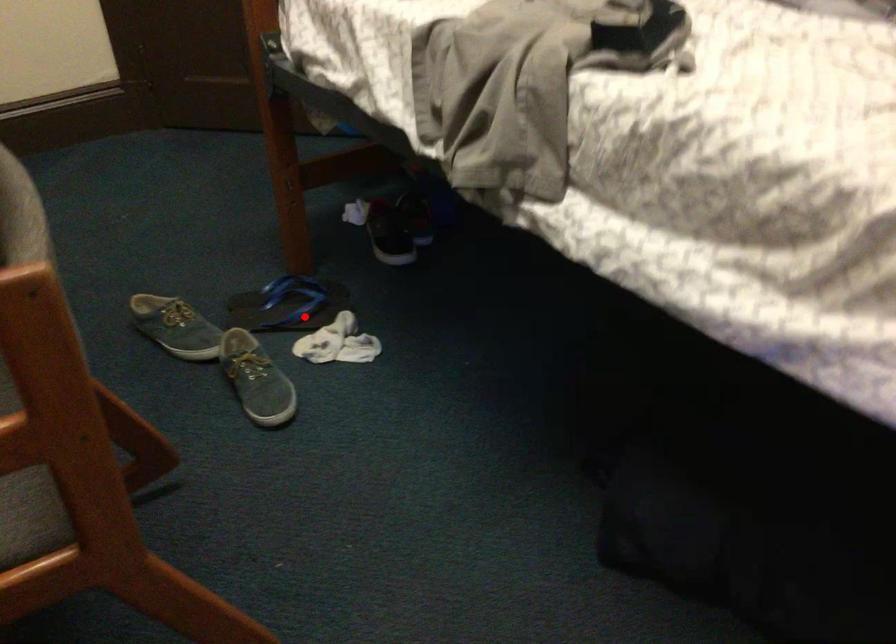
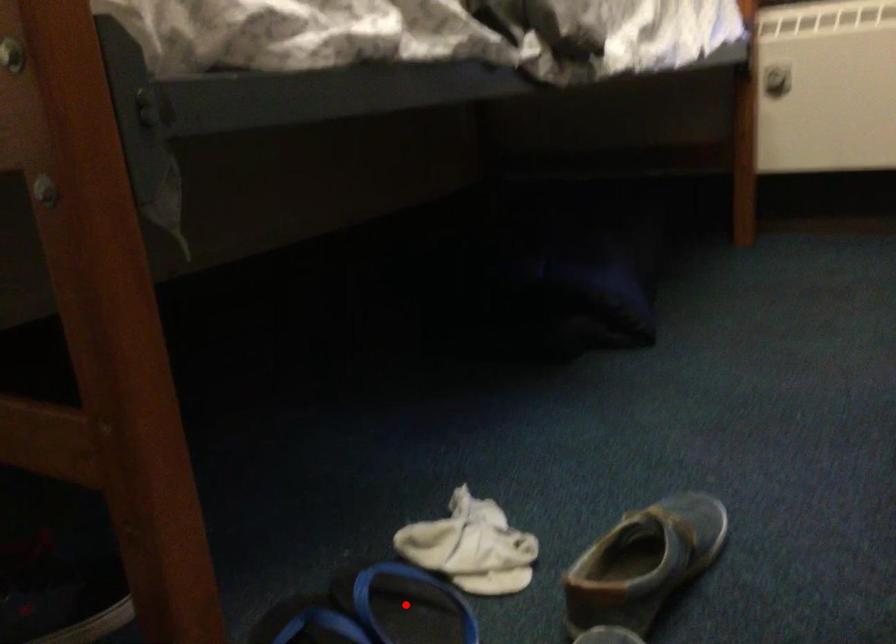
I am providing you with two images of the same scene from different viewpoints. A red point is marked on the first image and another point is marked on the second image. Do the highlighted points in image1 and image2 indicate the same real-world spot?

Yes